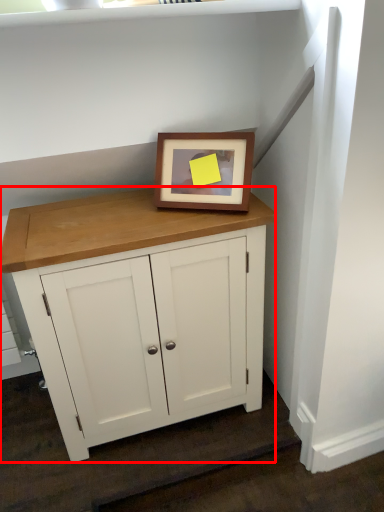
Question: Considering the relative positions of table (annotated by the red box) and picture frame in the image provided, where is table (annotated by the red box) located with respect to the staircase?

Choices:
 (A) left
 (B) right

Answer: (A)